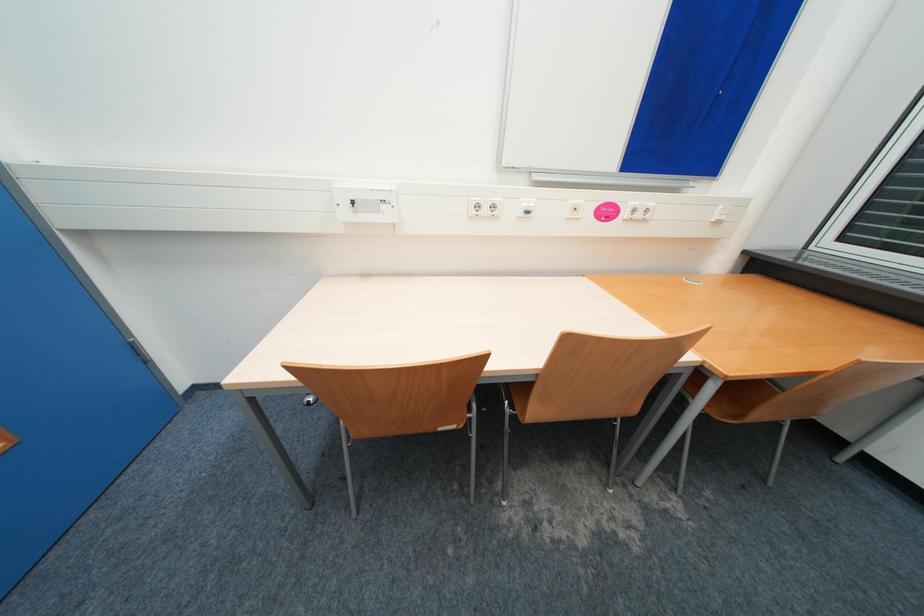
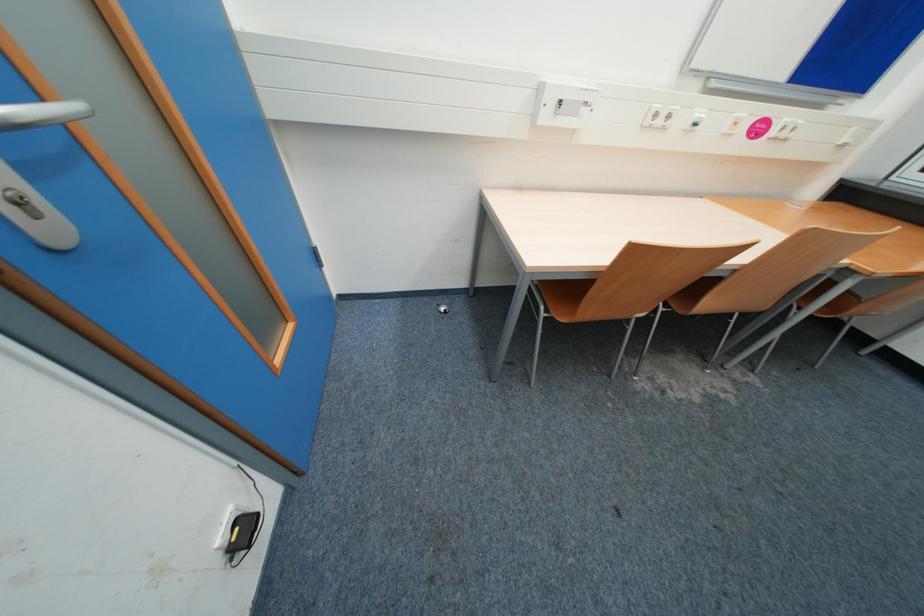
Question: How did the camera likely rotate?

Choices:
 (A) Left
 (B) Right
 (C) Up
 (D) Down

Answer: (D)